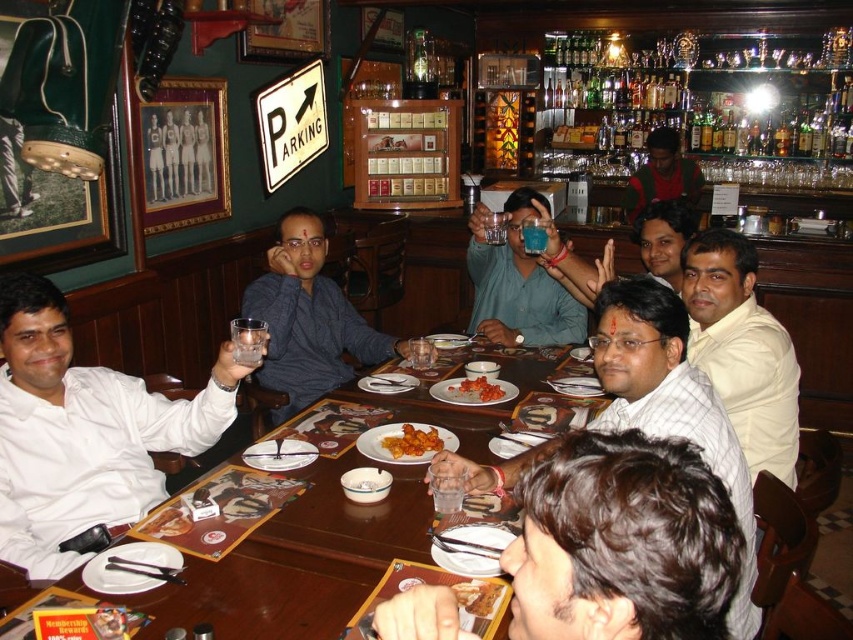
You are a waiter in a restaurant. You need to place a new dish on the table at the exact center of the table. The table has a coordinate system where the bottom left corner is the origin point. The coordinates of the center of the table are at point 0.5, 0.5. Where should you place the dish relative to the matte blue glass at center?

The matte blue glass at center is already positioned at coordinates (517, 284), which is slightly to the left and above the exact center of the table at (426, 320). Therefore, to place the dish at the exact center, you should move it slightly to the right and below the current position of the matte blue glass at center.